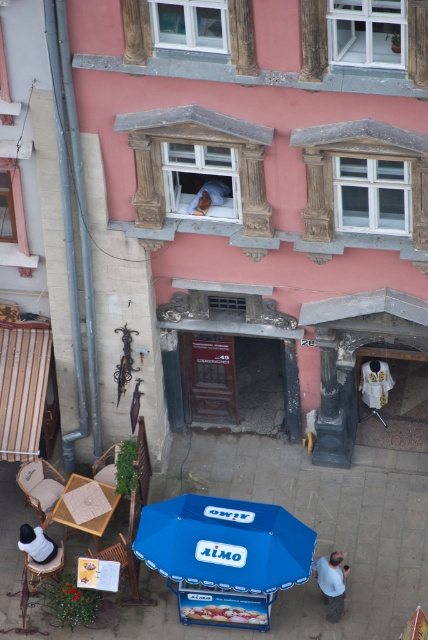
Question: Is blue fabric umbrella at lower center further to camera compared to light brown woven chair at lower left?

Choices:
 (A) no
 (B) yes

Answer: (A)

Question: Which point is closer to the camera?

Choices:
 (A) (62, 477)
 (B) (149, 518)
 (C) (133, 579)
 (D) (332, 560)

Answer: (B)

Question: Estimate the real-world distances between objects in this image. Which object is closer to the wooden chair at lower left?

Choices:
 (A) light brown woven chair at lower left
 (B) white fabric shirt at lower left

Answer: (B)

Question: Observing the image, what is the correct spatial positioning of light brown leather jacket at lower center in reference to wooden chair at lower left?

Choices:
 (A) right
 (B) left

Answer: (A)

Question: Which point appears closest to the camera in this image?

Choices:
 (A) (154, 554)
 (B) (24, 476)

Answer: (A)

Question: Can you confirm if white fabric shirt at lower left is positioned below wooden chair at lower left?

Choices:
 (A) no
 (B) yes

Answer: (A)